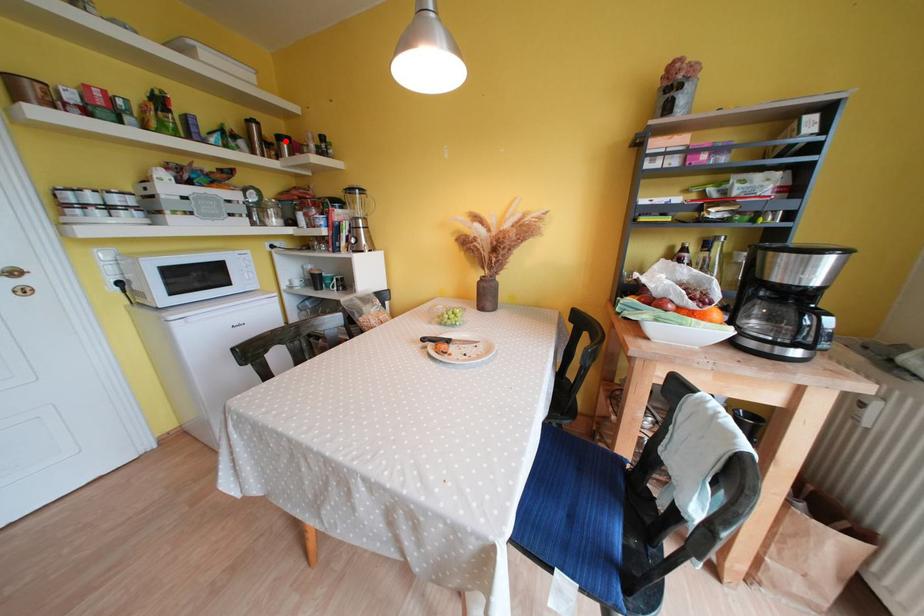
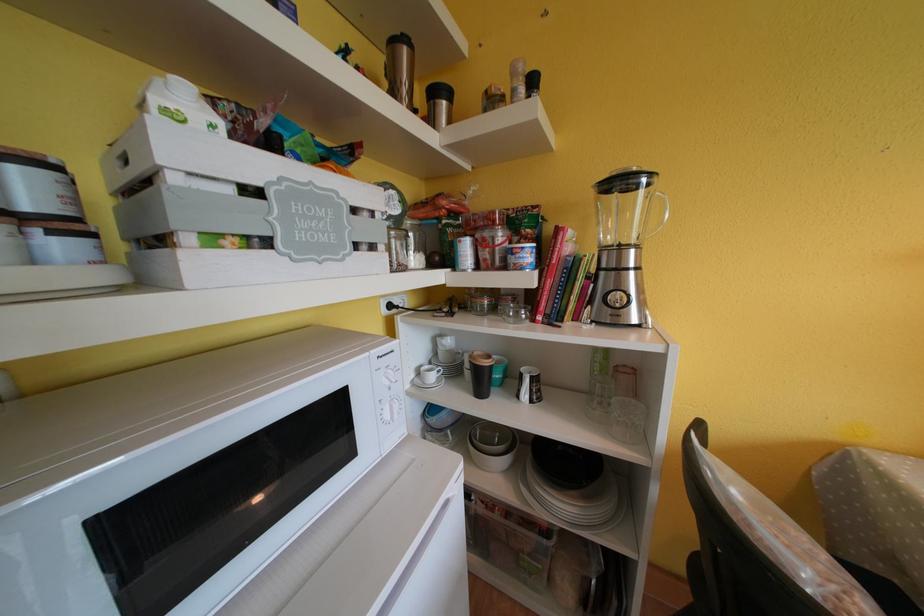
In the second image, find the point that corresponds to the highlighted location in the first image.

(440, 95)